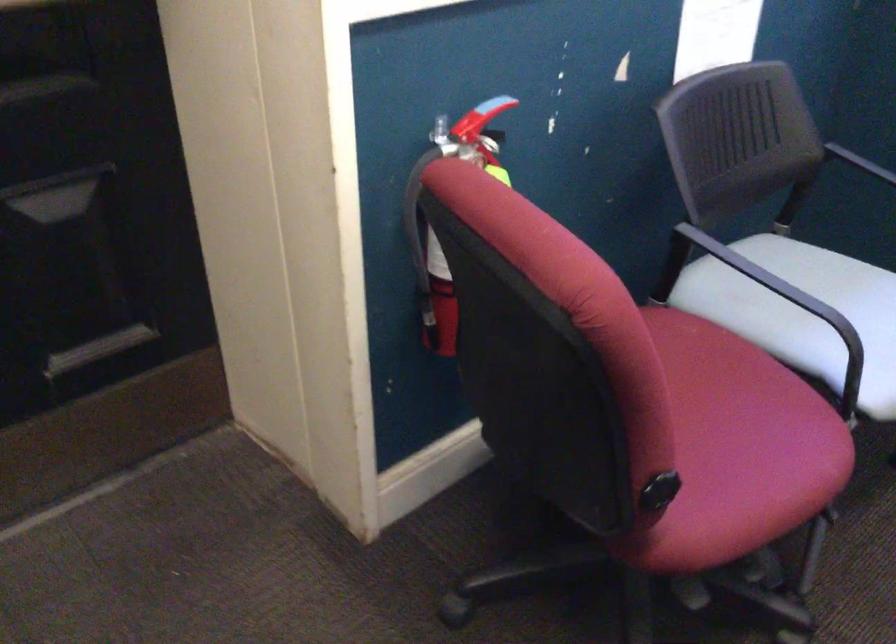
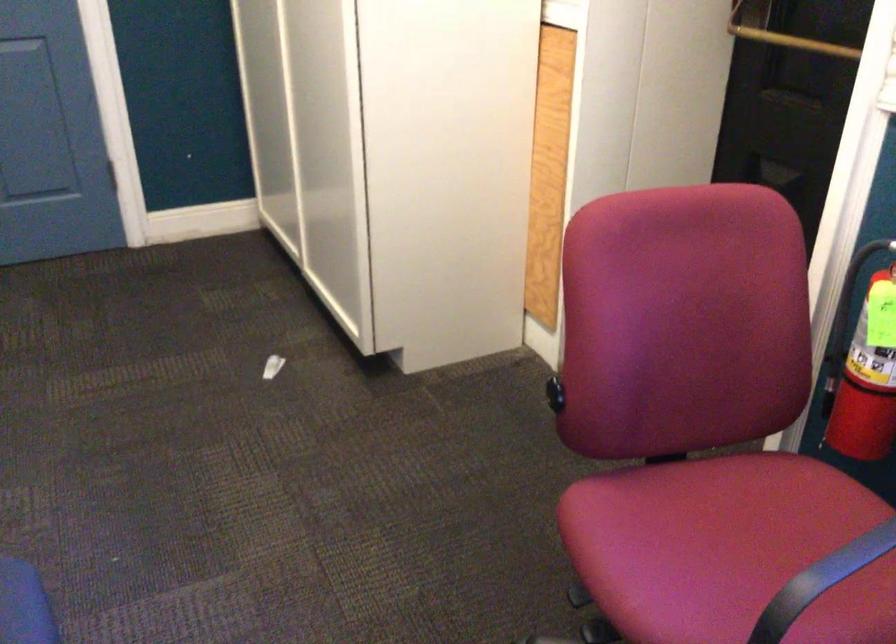
In the second image, find the point that corresponds to point (481, 156) in the first image.

(892, 269)